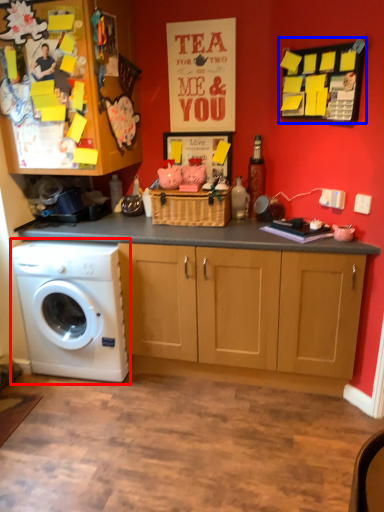
Question: Which object is closer to the camera taking this photo, washing machine (highlighted by a red box) or bulletin board (highlighted by a blue box)?

Choices:
 (A) washing machine
 (B) bulletin board

Answer: (B)